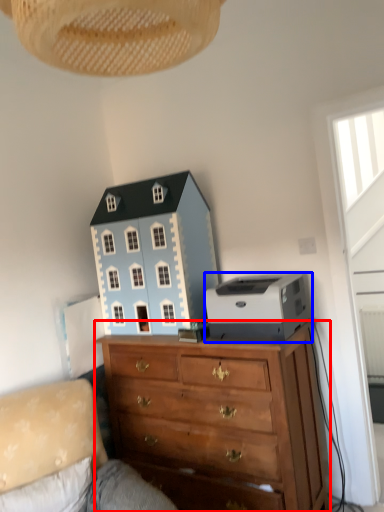
Question: Among these objects, which one is nearest to the camera, chest of drawers (highlighted by a red box) or printer (highlighted by a blue box)?

Choices:
 (A) chest of drawers
 (B) printer

Answer: (A)